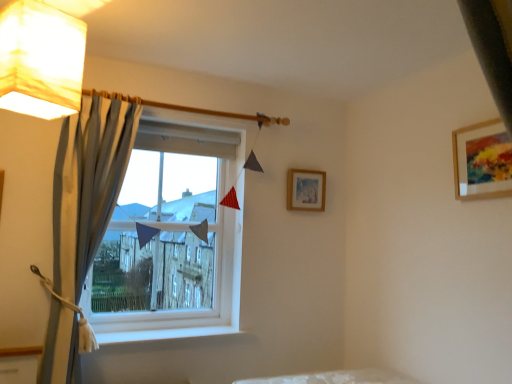
Where is `white paper lampshade at upper left`? This screenshot has height=384, width=512. white paper lampshade at upper left is located at coordinates (40, 60).

You are a GUI agent. You are given a task and a screenshot of the screen. Output one action in this format:
    pyautogui.click(x=<x>, y=<y>)
    Task: Click on the wooden picture frame at upper right, the 1th picture frame in the left-to-right sequence
    
    Given the screenshot: What is the action you would take?
    pyautogui.click(x=306, y=190)

This screenshot has width=512, height=384. What do you see at coordinates (83, 218) in the screenshot?
I see `blue striped curtain at left` at bounding box center [83, 218].

I want to click on white plastic window at center, so click(x=170, y=243).

Is blue striped curtain at left positioned with its back to wooden-framed artwork at upper right, the first picture frame when ordered from right to left?

blue striped curtain at left does not have its back to wooden-framed artwork at upper right, the first picture frame when ordered from right to left.

From the image's perspective, is blue striped curtain at left located beneath wooden-framed artwork at upper right, the first picture frame when ordered from right to left?

Yes, from the image's perspective, blue striped curtain at left is below wooden-framed artwork at upper right, the first picture frame when ordered from right to left.

Is blue striped curtain at left wider or thinner than wooden-framed artwork at upper right, the first picture frame when ordered from right to left?

Clearly, blue striped curtain at left has more width compared to wooden-framed artwork at upper right, the first picture frame when ordered from right to left.

Is blue striped curtain at left positioned far away from wooden-framed artwork at upper right, positioned as the second picture frame in left-to-right order?

Result: blue striped curtain at left is positioned a significant distance from wooden-framed artwork at upper right, positioned as the second picture frame in left-to-right order.

Between white paper lampshade at upper left and blue striped curtain at left, which one has larger width?

white paper lampshade at upper left is wider.

Is white paper lampshade at upper left positioned far away from blue striped curtain at left?

white paper lampshade at upper left is near blue striped curtain at left, not far away.

Which is behind, point (16, 42) or point (66, 298)?

The point (66, 298) is farther.

Is white paper lampshade at upper left shorter than white plastic window at center?

Indeed, white paper lampshade at upper left has a lesser height compared to white plastic window at center.

From a real-world perspective, is white paper lampshade at upper left positioned above or below white plastic window at center?

From a real-world perspective, white paper lampshade at upper left is physically above white plastic window at center.

Is white plastic window at center located within white paper lampshade at upper left?

Definitely not — white plastic window at center is not inside white paper lampshade at upper left.

Considering the points (56, 236) and (322, 210), which point is behind, point (56, 236) or point (322, 210)?

The point (322, 210) is behind.

From the blue striped curtain at left, count 1st picture frame to the right and point to it. Please provide its 2D coordinates.

[(306, 190)]

From the image's perspective, would you say blue striped curtain at left is positioned over wooden picture frame at upper right, acting as the second picture frame starting from the front?

No, from the image's perspective, blue striped curtain at left is not above wooden picture frame at upper right, acting as the second picture frame starting from the front.

In terms of size, does blue striped curtain at left appear bigger or smaller than wooden picture frame at upper right, positioned as the 2th picture frame in right-to-left order?

Considering their sizes, blue striped curtain at left takes up more space than wooden picture frame at upper right, positioned as the 2th picture frame in right-to-left order.

Identify the location of window below the wooden picture frame at upper right, acting as the 1th picture frame starting from the back (from a real-world perspective). The height and width of the screenshot is (384, 512). (170, 243).

Would you consider wooden picture frame at upper right, acting as the second picture frame starting from the front, to be distant from white plastic window at center?

Actually, wooden picture frame at upper right, acting as the second picture frame starting from the front, and white plastic window at center are a little close together.

Considering the sizes of objects wooden picture frame at upper right, the 1th picture frame in the left-to-right sequence, and white plastic window at center in the image provided, who is bigger, wooden picture frame at upper right, the 1th picture frame in the left-to-right sequence, or white plastic window at center?

white plastic window at center.

Is wooden picture frame at upper right, the 1th picture frame in the left-to-right sequence, positioned beyond the bounds of white plastic window at center?

Result: wooden picture frame at upper right, the 1th picture frame in the left-to-right sequence, is positioned outside white plastic window at center.

Can you confirm if white smooth window sill at lower center is taller than wooden picture frame at upper right, positioned as the 2th picture frame in right-to-left order?

In fact, white smooth window sill at lower center may be shorter than wooden picture frame at upper right, positioned as the 2th picture frame in right-to-left order.

Who is smaller, white smooth window sill at lower center or wooden picture frame at upper right, the 1th picture frame in the left-to-right sequence?

wooden picture frame at upper right, the 1th picture frame in the left-to-right sequence.

In the scene shown: In terms of width, does white smooth window sill at lower center look wider or thinner when compared to wooden picture frame at upper right, the 1th picture frame in the left-to-right sequence?

Clearly, white smooth window sill at lower center has more width compared to wooden picture frame at upper right, the 1th picture frame in the left-to-right sequence.

Which object is closer to the camera taking this photo, white smooth window sill at lower center or wooden picture frame at upper right, positioned as the 2th picture frame in right-to-left order?

Positioned in front is white smooth window sill at lower center.

Is white smooth window sill at lower center bigger or smaller than wooden-framed artwork at upper right, positioned as the first picture frame in front-to-back order?

Considering their sizes, white smooth window sill at lower center takes up less space than wooden-framed artwork at upper right, positioned as the first picture frame in front-to-back order.

Is white smooth window sill at lower center to the left or to the right of wooden-framed artwork at upper right, positioned as the first picture frame in front-to-back order, in the image?

Clearly, white smooth window sill at lower center is on the left of wooden-framed artwork at upper right, positioned as the first picture frame in front-to-back order, in the image.

Considering the positions of point (226, 332) and point (456, 170), is point (226, 332) closer or farther from the camera than point (456, 170)?

Point (226, 332) appears to be farther away from the viewer than point (456, 170).

The height and width of the screenshot is (384, 512). What are the coordinates of `picture frame that is in front of the blue striped curtain at left` in the screenshot? It's located at (482, 161).

I want to click on curtain on the left of white paper lampshade at upper left, so click(x=83, y=218).

From the image, which object appears to be farther from white plastic window at center, wooden picture frame at upper right, positioned as the 2th picture frame in right-to-left order, or white smooth window sill at lower center?

wooden picture frame at upper right, positioned as the 2th picture frame in right-to-left order, is positioned further to the anchor white plastic window at center.

Estimate the real-world distances between objects in this image. Which object is further from wooden picture frame at upper right, acting as the second picture frame starting from the front, white smooth window sill at lower center or wooden-framed artwork at upper right, positioned as the first picture frame in front-to-back order?

wooden-framed artwork at upper right, positioned as the first picture frame in front-to-back order.

Based on their spatial positions, is blue striped curtain at left or white smooth window sill at lower center closer to wooden picture frame at upper right, acting as the 1th picture frame starting from the back?

Based on the image, white smooth window sill at lower center appears to be nearer to wooden picture frame at upper right, acting as the 1th picture frame starting from the back.

Estimate the real-world distances between objects in this image. Which object is further from white paper lampshade at upper left, wooden picture frame at upper right, the 1th picture frame in the left-to-right sequence, or white smooth window sill at lower center?

wooden picture frame at upper right, the 1th picture frame in the left-to-right sequence.

Which object lies nearer to the anchor point white plastic window at center, blue striped curtain at left or wooden picture frame at upper right, acting as the 1th picture frame starting from the back?

The object closer to white plastic window at center is blue striped curtain at left.

Which object lies further to the anchor point white smooth window sill at lower center, wooden-framed artwork at upper right, the second picture frame in the back-to-front sequence, or white plastic window at center?

wooden-framed artwork at upper right, the second picture frame in the back-to-front sequence, is positioned further to the anchor white smooth window sill at lower center.

Estimate the real-world distances between objects in this image. Which object is closer to wooden-framed artwork at upper right, positioned as the first picture frame in front-to-back order, blue striped curtain at left or white paper lampshade at upper left?

white paper lampshade at upper left.

Considering their positions, is blue striped curtain at left positioned further to wooden-framed artwork at upper right, the second picture frame in the back-to-front sequence, than wooden picture frame at upper right, acting as the 1th picture frame starting from the back?

blue striped curtain at left is further to wooden-framed artwork at upper right, the second picture frame in the back-to-front sequence.

The image size is (512, 384). I want to click on picture frame between white paper lampshade at upper left and wooden-framed artwork at upper right, positioned as the second picture frame in left-to-right order, so click(x=306, y=190).

Where is `lamp located between blue striped curtain at left and wooden-framed artwork at upper right, positioned as the first picture frame in front-to-back order, in the left-right direction`? Image resolution: width=512 pixels, height=384 pixels. lamp located between blue striped curtain at left and wooden-framed artwork at upper right, positioned as the first picture frame in front-to-back order, in the left-right direction is located at coordinates (40, 60).

You are a GUI agent. You are given a task and a screenshot of the screen. Output one action in this format:
    pyautogui.click(x=<x>, y=<y>)
    Task: Click on the curtain between white paper lampshade at upper left and white smooth window sill at lower center in the vertical direction
    
    Given the screenshot: What is the action you would take?
    pyautogui.click(x=83, y=218)

The image size is (512, 384). Find the location of `curtain between white paper lampshade at upper left and white plastic window at center from front to back`. curtain between white paper lampshade at upper left and white plastic window at center from front to back is located at coordinates (83, 218).